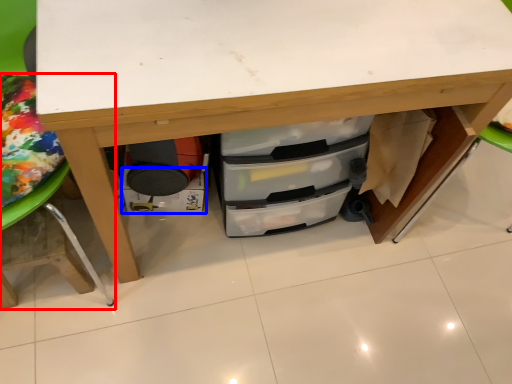
Question: Which object appears farthest to the camera in this image, furniture (highlighted by a red box) or drawer (highlighted by a blue box)?

Choices:
 (A) furniture
 (B) drawer

Answer: (B)